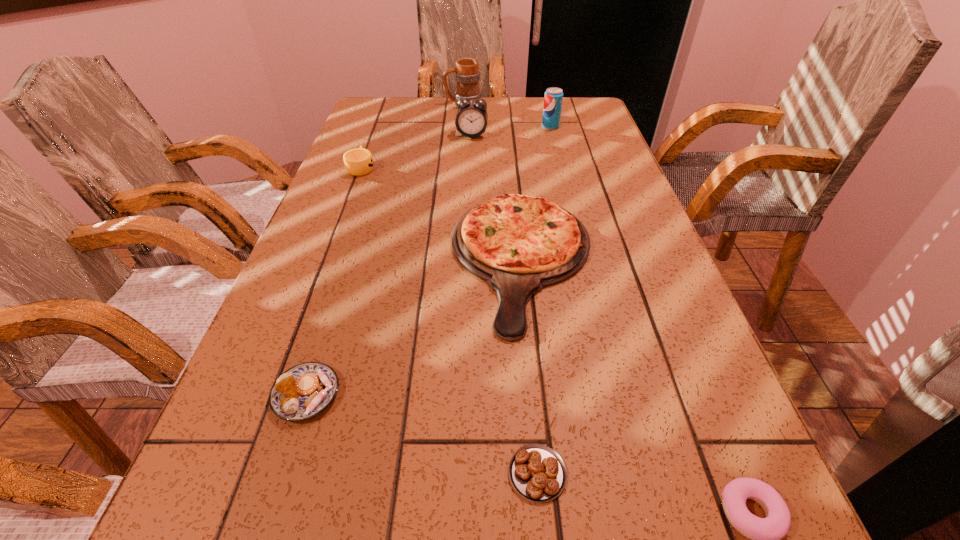
At what (x,y) coordinates should I click in order to perform the action: click on the tallest object. Please return your answer as a coordinate pair (x, y). The image size is (960, 540). Looking at the image, I should click on (467, 73).

This screenshot has height=540, width=960. In order to click on the farthest object in this screenshot , I will do `click(467, 73)`.

You are a GUI agent. You are given a task and a screenshot of the screen. Output one action in this format:
    pyautogui.click(x=<x>, y=<y>)
    Task: Click on the seventh nearest object
    
    Given the screenshot: What is the action you would take?
    point(553,98)

Find the location of `the third farthest object`. the third farthest object is located at coordinates (471, 120).

You are a GUI agent. You are given a task and a screenshot of the screen. Output one action in this format:
    pyautogui.click(x=<x>, y=<y>)
    Task: Click on the pizza
    
    Given the screenshot: What is the action you would take?
    pyautogui.click(x=518, y=244)

Identify the location of the fifth nearest object. The height and width of the screenshot is (540, 960). (358, 162).

Find the location of `the farthest pastry`. the farthest pastry is located at coordinates (305, 390).

Where is `the tallest pastry`? This screenshot has width=960, height=540. the tallest pastry is located at coordinates (305, 390).

I want to click on the shortest pastry, so click(537, 472).

You are a GUI agent. You are given a task and a screenshot of the screen. Output one action in this format:
    pyautogui.click(x=<x>, y=<y>)
    Task: Click on the shortest object
    This screenshot has width=960, height=540.
    Given the screenshot: What is the action you would take?
    pyautogui.click(x=537, y=472)